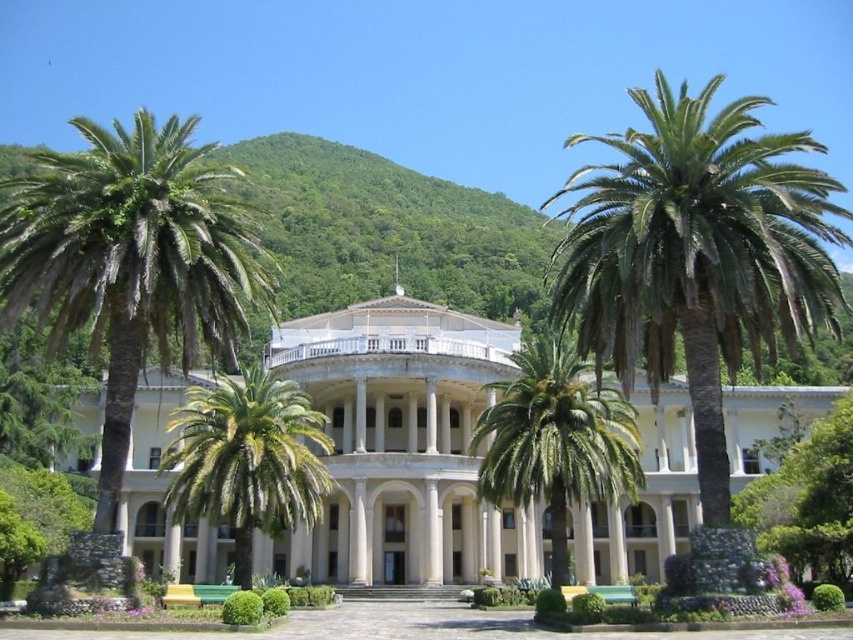
You are standing in front of the classical building and want to take a photo that includes both the green leafy palm at right and the green leafy palm at left. Which palm should you position closer to the camera to ensure both are in focus?

The green leafy palm at right is already closer to the viewer than the green leafy palm at left, so positioning it closer to the camera will ensure both palms are in focus.

You are standing in front of the grand classical building and notice two green leafy palms. Which palm is closer to you, the green leafy palm at right or the green leafy palm at left?

The green leafy palm at right is closer to you because it is positioned over the green leafy palm at left, indicating it is in front.